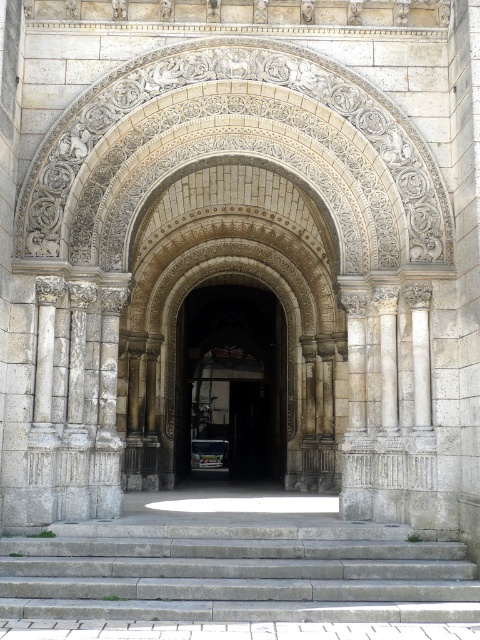
Question: Is gray concrete stairs at lower center further to the viewer compared to dark stone archway at center?

Choices:
 (A) yes
 (B) no

Answer: (B)

Question: Can you confirm if gray concrete stairs at lower center is wider than dark stone archway at center?

Choices:
 (A) no
 (B) yes

Answer: (B)

Question: Which point appears farthest from the camera in this image?

Choices:
 (A) [x=276, y=417]
 (B) [x=463, y=582]

Answer: (A)

Question: Which point is closer to the camera?

Choices:
 (A) (223, 339)
 (B) (361, 579)

Answer: (B)

Question: Does gray concrete stairs at lower center appear on the right side of dark stone archway at center?

Choices:
 (A) yes
 (B) no

Answer: (A)

Question: Which point is closer to the camera?

Choices:
 (A) gray concrete stairs at lower center
 (B) dark stone archway at center

Answer: (A)